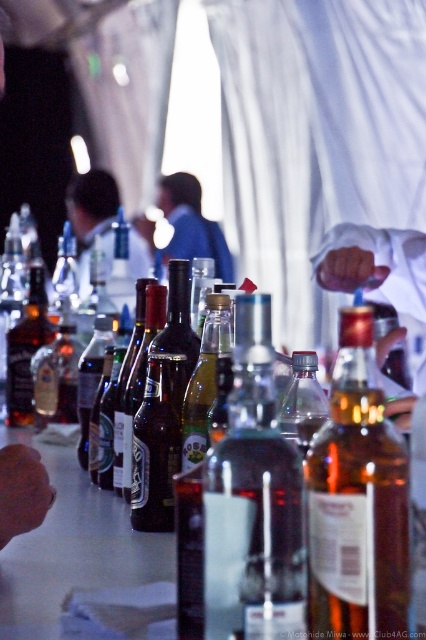
From the picture: You are standing at the bar and want to reach the point marked as point (319, 602). The bar counter is 24 inches wide. Can you comfortably reach that point without moving your body?

The point (319, 602) is 24.89 inches away from the viewer. Since the bar counter is only 24 inches wide, you might need to lean slightly forward to comfortably reach it.

You are a bartender who needs to place a coaster under the tallest bottle between the translucent glass wine bottle at center and the translucent glass beer bottle at center. Which bottle should you place the coaster under?

The translucent glass beer bottle at center is taller than the translucent glass wine bottle at center, so you should place the coaster under the translucent glass beer bottle at center.

You are a bartender who needs to place a new bottle between the translucent glass wine bottle at center and the translucent glass beer bottle at center. Which side of the beer bottle should you place it on to keep them in order?

The translucent glass wine bottle at center is positioned on the right side of the translucent glass beer bottle at center, so to maintain their order, you should place the new bottle to the right of the beer bottle.